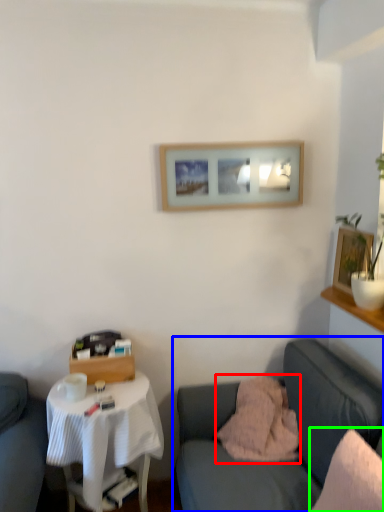
Question: Which object is positioned closest to pillow (highlighted by a red box)? Select from studio couch (highlighted by a blue box) and pillow (highlighted by a green box).

Choices:
 (A) studio couch
 (B) pillow

Answer: (A)